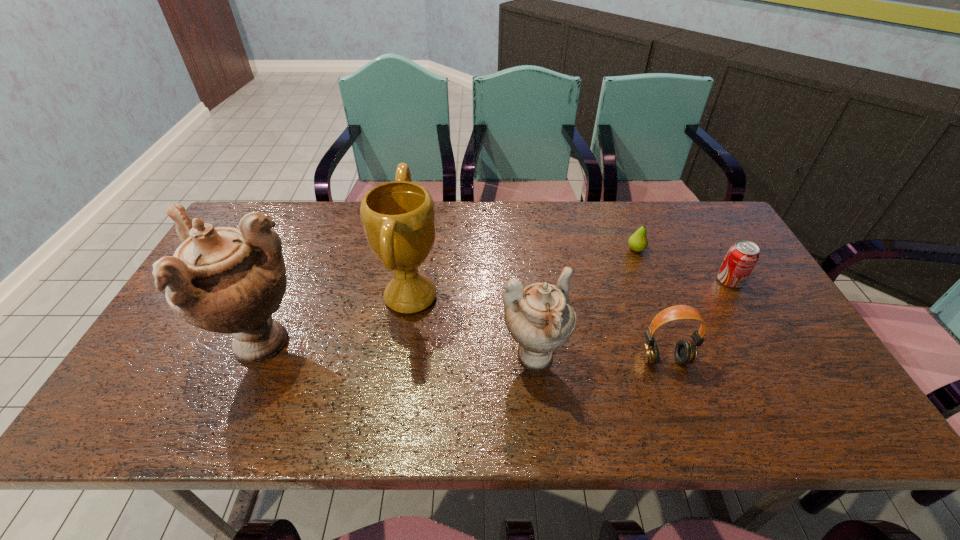
Where is `object that is at the near left corner`? object that is at the near left corner is located at coordinates click(226, 280).

Find the location of a particular element. vacant space at the far edge of the desktop is located at coordinates (466, 242).

In the image, there is a desktop. At what (x,y) coordinates should I click in order to perform the action: click on blank space at the near edge. Please return your answer as a coordinate pair (x, y). The image size is (960, 540). Looking at the image, I should click on (323, 387).

The image size is (960, 540). Find the location of `free space at the left edge of the desktop`. free space at the left edge of the desktop is located at coordinates (209, 338).

In order to click on vacant space at the near right corner of the desktop in this screenshot , I will do `click(801, 383)`.

You are a GUI agent. You are given a task and a screenshot of the screen. Output one action in this format:
    pyautogui.click(x=<x>, y=<y>)
    Task: Click on the unoccupied area between the taller urn and the award
    The width and height of the screenshot is (960, 540).
    Given the screenshot: What is the action you would take?
    pyautogui.click(x=335, y=321)

The image size is (960, 540). Find the location of `vacant area that lies between the shortest object and the third object from left to right`. vacant area that lies between the shortest object and the third object from left to right is located at coordinates (585, 304).

Locate an element on the screen. empty space that is in between the taller urn and the award is located at coordinates (335, 321).

Where is `free spot between the left urn and the pear`? The image size is (960, 540). free spot between the left urn and the pear is located at coordinates (447, 297).

Image resolution: width=960 pixels, height=540 pixels. I want to click on free area in between the third object from left to right and the rightmost object, so click(x=632, y=320).